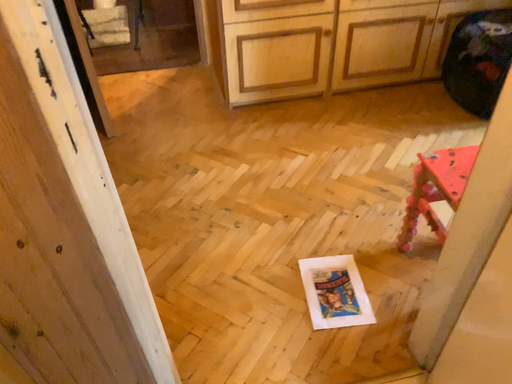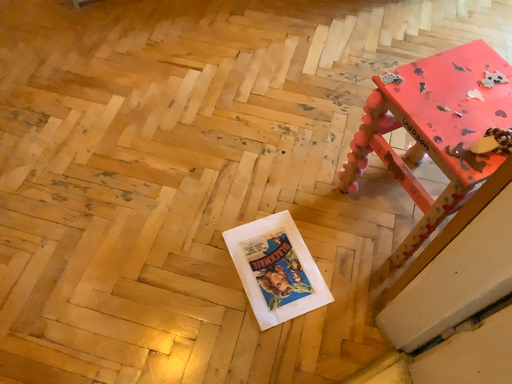
Question: How did the camera likely rotate when shooting the video?

Choices:
 (A) rotated upward
 (B) rotated downward

Answer: (B)